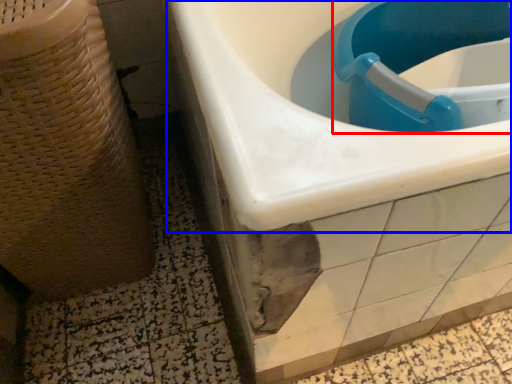
Question: Which of the following is the closest to the observer, sink (highlighted by a red box) or sink (highlighted by a blue box)?

Choices:
 (A) sink
 (B) sink

Answer: (A)